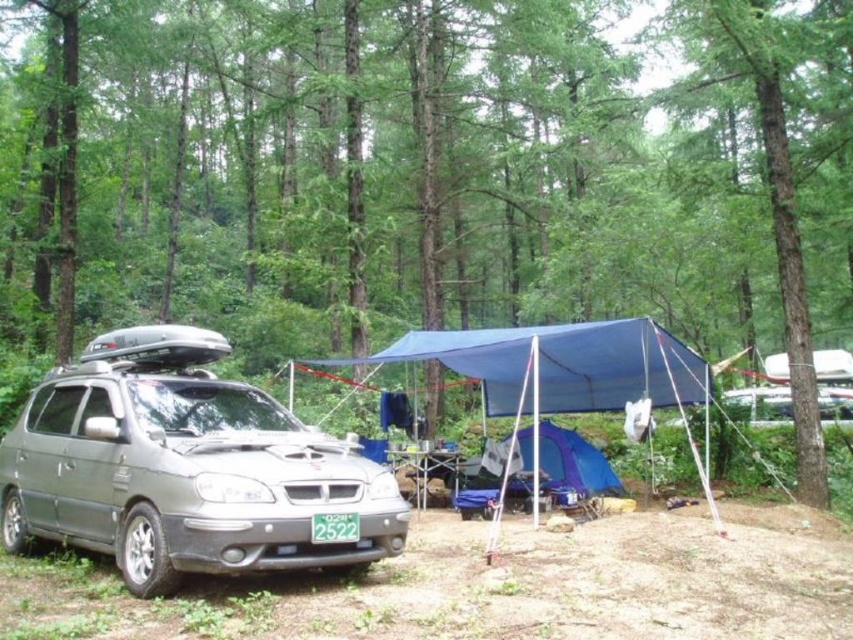
Question: Which object is positioned farthest from the silver metallic minivan at center?

Choices:
 (A) purple fabric tent at center
 (B) blue fabric tent at center
 (C) blue fabric canopy at center
 (D) green matte license plate at center

Answer: (A)

Question: Is blue fabric tent at center wider than green matte license plate at center?

Choices:
 (A) no
 (B) yes

Answer: (B)

Question: Which of these objects is positioned farthest from the blue fabric tent at center?

Choices:
 (A) purple fabric tent at center
 (B) blue fabric canopy at center

Answer: (A)

Question: Is silver metallic minivan at center further to the viewer compared to purple fabric tent at center?

Choices:
 (A) yes
 (B) no

Answer: (B)

Question: Which object is farther from the camera taking this photo?

Choices:
 (A) silver metallic minivan at center
 (B) blue fabric canopy at center
 (C) purple fabric tent at center

Answer: (C)

Question: Is blue fabric tent at center positioned at the back of blue fabric canopy at center?

Choices:
 (A) no
 (B) yes

Answer: (A)